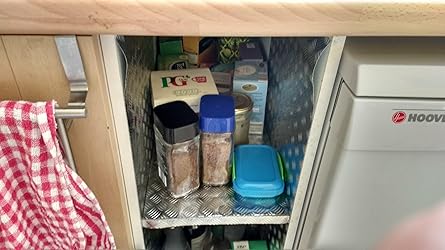
What are the coordinates of `shelf liner` in the screenshot? It's located at point(141,66), point(302,72), point(206,206).